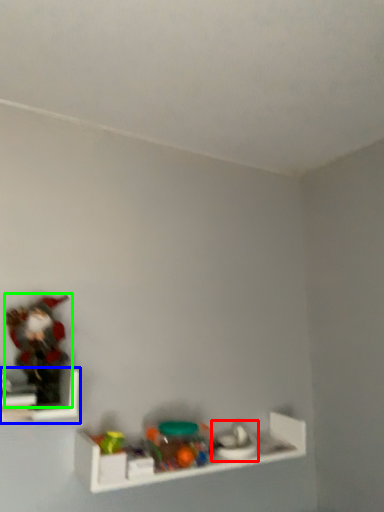
Question: Which is farther away from toy (highlighted by a red box)? shelf (highlighted by a blue box) or toy (highlighted by a green box)?

Choices:
 (A) shelf
 (B) toy

Answer: (B)